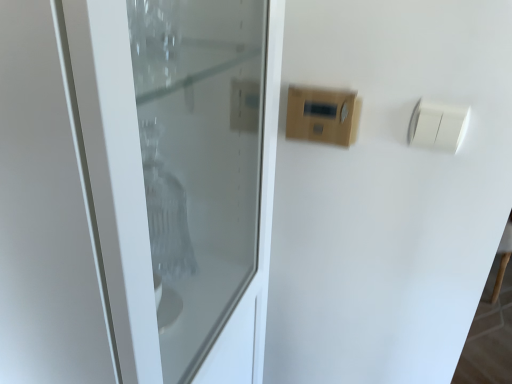
Question: Is white plastic light switch at upper right, the first light switch positioned from the right, next to wooden panel at upper center, which is the second light switch in right-to-left order?

Choices:
 (A) yes
 (B) no

Answer: (B)

Question: Does white plastic light switch at upper right, acting as the 2th light switch starting from the left, have a greater height compared to wooden panel at upper center, which is the second light switch in right-to-left order?

Choices:
 (A) yes
 (B) no

Answer: (B)

Question: Is white plastic light switch at upper right, the first light switch positioned from the right, at the left side of wooden panel at upper center, which is the second light switch in right-to-left order?

Choices:
 (A) no
 (B) yes

Answer: (A)

Question: From the image's perspective, does white plastic light switch at upper right, the first light switch positioned from the right, appear higher than wooden panel at upper center, which is the second light switch in right-to-left order?

Choices:
 (A) no
 (B) yes

Answer: (A)

Question: Would you consider white plastic light switch at upper right, the first light switch positioned from the right, to be distant from wooden panel at upper center, placed as the first light switch when sorted from left to right?

Choices:
 (A) no
 (B) yes

Answer: (A)

Question: Is white glossy door at center spatially inside wooden panel at upper center, placed as the first light switch when sorted from left to right, or outside of it?

Choices:
 (A) outside
 (B) inside

Answer: (A)

Question: In terms of height, does white glossy door at center look taller or shorter compared to wooden panel at upper center, placed as the first light switch when sorted from left to right?

Choices:
 (A) tall
 (B) short

Answer: (A)

Question: Is white glossy door at center in front of or behind wooden panel at upper center, placed as the first light switch when sorted from left to right, in the image?

Choices:
 (A) behind
 (B) front

Answer: (B)

Question: From a real-world perspective, is white glossy door at center physically located above or below wooden panel at upper center, which is the second light switch in right-to-left order?

Choices:
 (A) above
 (B) below

Answer: (B)

Question: Is wooden panel at upper center, placed as the first light switch when sorted from left to right, to the left or to the right of white glossy door at center in the image?

Choices:
 (A) left
 (B) right

Answer: (B)

Question: In terms of width, does wooden panel at upper center, placed as the first light switch when sorted from left to right, look wider or thinner when compared to white glossy door at center?

Choices:
 (A) thin
 (B) wide

Answer: (A)

Question: In the image, is wooden panel at upper center, placed as the first light switch when sorted from left to right, positioned in front of or behind white glossy door at center?

Choices:
 (A) behind
 (B) front

Answer: (A)

Question: Is point (321, 132) closer or farther from the camera than point (231, 311)?

Choices:
 (A) farther
 (B) closer

Answer: (A)

Question: Relative to white glossy door at center, is white plastic light switch at upper right, acting as the 2th light switch starting from the left, in front or behind?

Choices:
 (A) behind
 (B) front

Answer: (A)

Question: From a real-world perspective, is white plastic light switch at upper right, the first light switch positioned from the right, above or below white glossy door at center?

Choices:
 (A) above
 (B) below

Answer: (A)